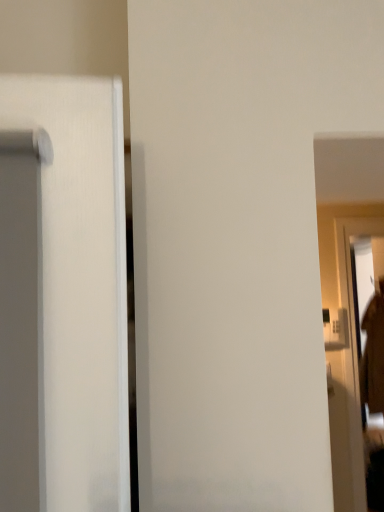
Question: From a real-world perspective, is clear glass screen door at right positioned above or below brown fuzzy robe at right?

Choices:
 (A) below
 (B) above

Answer: (B)

Question: Is point (357, 430) closer or farther from the camera than point (360, 369)?

Choices:
 (A) closer
 (B) farther

Answer: (A)

Question: In terms of height, does clear glass screen door at right look taller or shorter compared to brown fuzzy robe at right?

Choices:
 (A) short
 (B) tall

Answer: (B)

Question: From the image's perspective, is brown fuzzy robe at right above or below clear glass screen door at right?

Choices:
 (A) above
 (B) below

Answer: (B)

Question: From a real-world perspective, is brown fuzzy robe at right positioned above or below clear glass screen door at right?

Choices:
 (A) above
 (B) below

Answer: (B)

Question: Relative to clear glass screen door at right, is brown fuzzy robe at right in front or behind?

Choices:
 (A) front
 (B) behind

Answer: (B)

Question: Based on their positions, is brown fuzzy robe at right located to the left or right of clear glass screen door at right?

Choices:
 (A) left
 (B) right

Answer: (B)